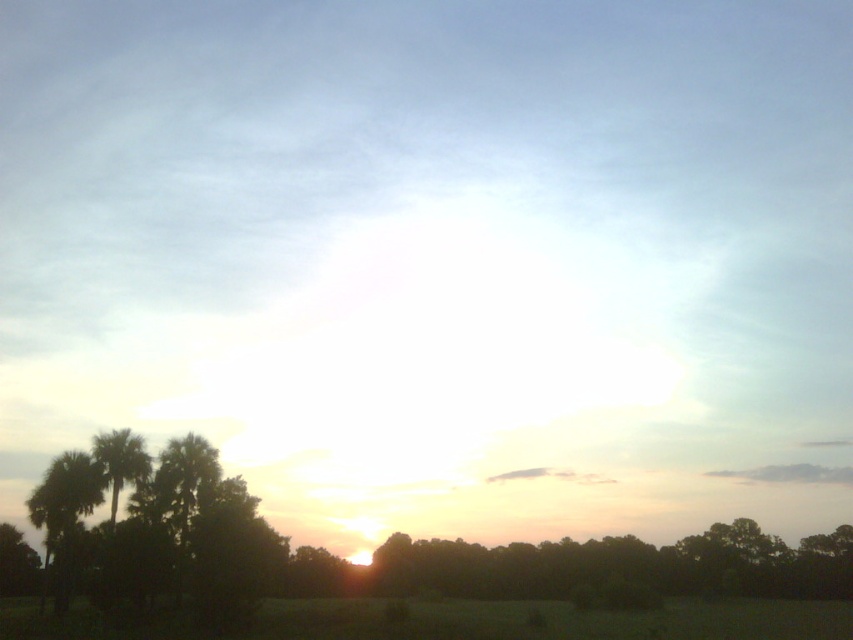
Does silhouette palm trees at lower left have a smaller size compared to green grassy field at lower center?

Yes.

Can you confirm if silhouette palm trees at lower left is wider than green grassy field at lower center?

No.

Does point (65, 531) come farther from viewer compared to point (518, 636)?

Yes, it is.

At what (x,y) coordinates should I click in order to perform the action: click on silhouette palm trees at lower left. Please return your answer as a coordinate pair (x, y). The width and height of the screenshot is (853, 640). Looking at the image, I should click on (160, 525).